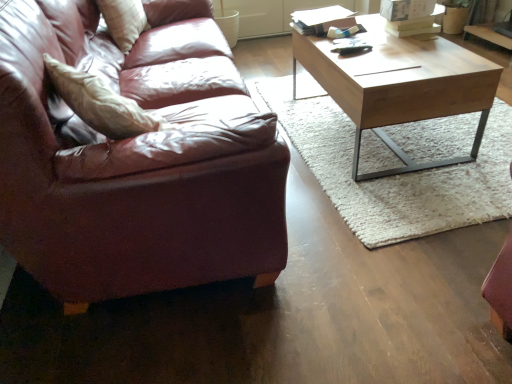
Where is `free space in front of light brown wood coffee table at center`? This screenshot has width=512, height=384. free space in front of light brown wood coffee table at center is located at coordinates (409, 195).